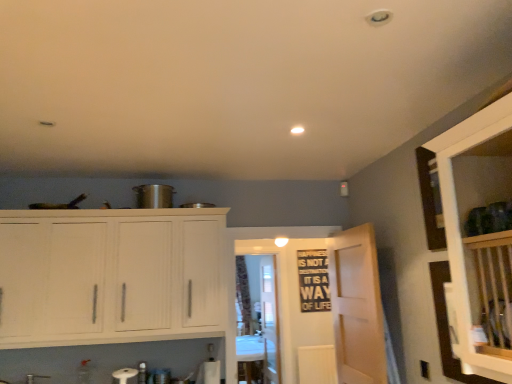
Question: Would you say light wood door at center is inside or outside patterned fabric curtain at center?

Choices:
 (A) inside
 (B) outside

Answer: (B)

Question: From a real-world perspective, is light wood door at center positioned above or below patterned fabric curtain at center?

Choices:
 (A) above
 (B) below

Answer: (B)

Question: Which object is positioned farthest from the patterned fabric curtain at center?

Choices:
 (A) black matte bulletin board at center
 (B) light wood door at center
 (C) transparent glass door at center, arranged as the second glass door when viewed from the front
 (D) transparent glass door at center, which is counted as the 1th glass door, starting from the front
 (E) white wood cabinets at left

Answer: (E)

Question: Based on their relative distances, which object is nearer to the white wood cabinets at left?

Choices:
 (A) patterned fabric curtain at center
 (B) transparent glass door at center, arranged as the second glass door when viewed from the front
 (C) black matte bulletin board at center
 (D) light wood door at center
 (E) transparent glass door at center, arranged as the second glass door when viewed from the back

Answer: (D)